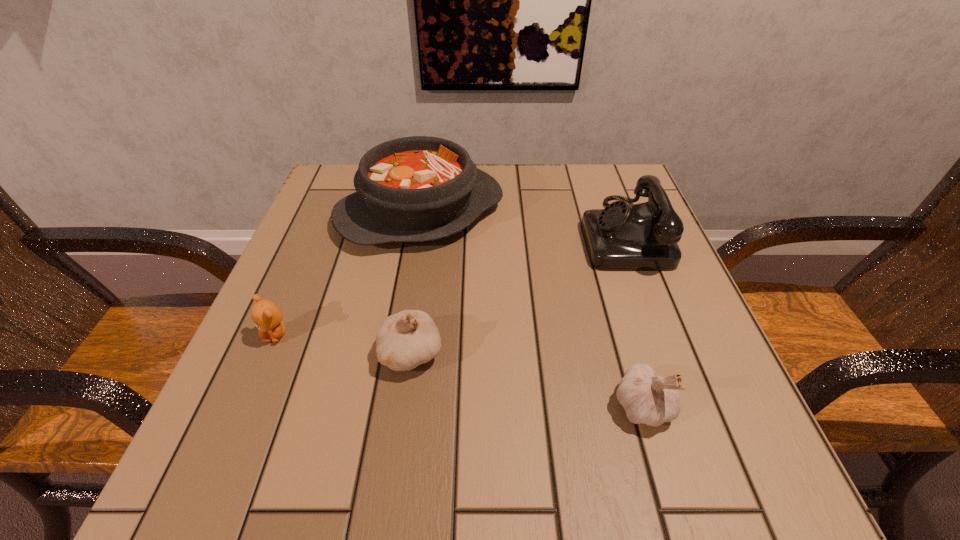
Where is `vacant area that satisfies the following two spatial constraints: 1. on the face of the shortest object; 2. on the right side of the right garlic`? Image resolution: width=960 pixels, height=540 pixels. vacant area that satisfies the following two spatial constraints: 1. on the face of the shortest object; 2. on the right side of the right garlic is located at coordinates (x=246, y=406).

Where is `free spot that satisfies the following two spatial constraints: 1. on the dial of the telephone; 2. on the front side of the left garlic`? free spot that satisfies the following two spatial constraints: 1. on the dial of the telephone; 2. on the front side of the left garlic is located at coordinates (667, 353).

Where is `free space that satisfies the following two spatial constraints: 1. on the front side of the casserole; 2. on the right side of the left garlic`? The image size is (960, 540). free space that satisfies the following two spatial constraints: 1. on the front side of the casserole; 2. on the right side of the left garlic is located at coordinates (397, 353).

Locate an element on the screen. The height and width of the screenshot is (540, 960). free location that satisfies the following two spatial constraints: 1. on the dial of the telephone; 2. on the face of the shortest object is located at coordinates (660, 334).